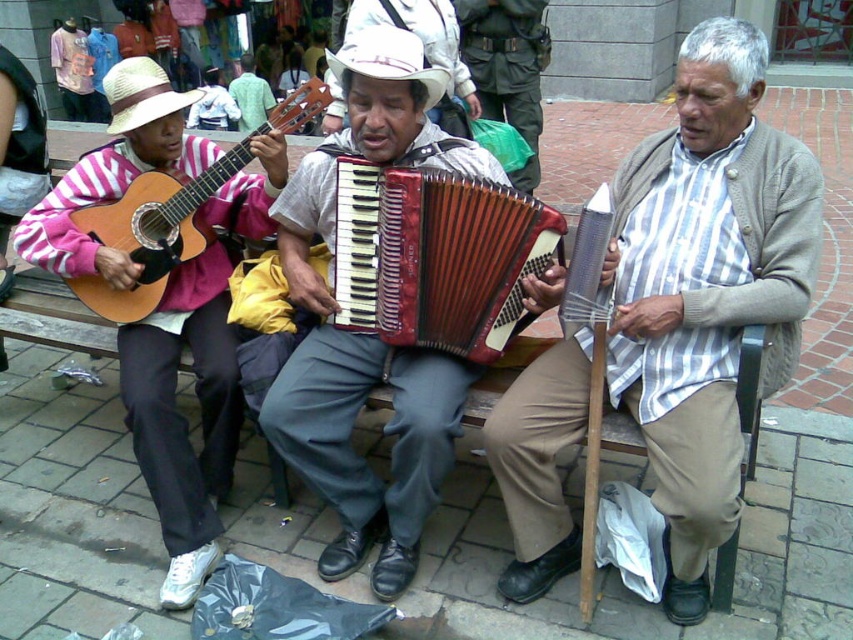
Who is shorter, matte pink sweater at left or green fabric bag at center?

Standing shorter between the two is green fabric bag at center.

Which is in front, point (73, 269) or point (531, 70)?

Positioned in front is point (73, 269).

Is point (222, 333) closer to camera compared to point (506, 49)?

Yes, it is in front of point (506, 49).

Where is `matte pink sweater at left`? matte pink sweater at left is located at coordinates (183, 417).

Is matte red accordion at center behind matte wood guitar at left?

That is False.

Is point (339, 426) closer to camera compared to point (83, 214)?

Yes, it is in front of point (83, 214).

Identify the location of matte red accordion at center. (x=367, y=326).

Looking at this image, which is more to the right, red leather accordion at center or matte wood guitar at left?

red leather accordion at center is more to the right.

Does red leather accordion at center have a lesser width compared to matte wood guitar at left?

Yes, red leather accordion at center is thinner than matte wood guitar at left.

Image resolution: width=853 pixels, height=640 pixels. Find the location of `red leather accordion at center`. red leather accordion at center is located at coordinates (436, 253).

At what (x,y) coordinates should I click in order to perform the action: click on red leather accordion at center. Please return your answer as a coordinate pair (x, y). Looking at the image, I should click on (436, 253).